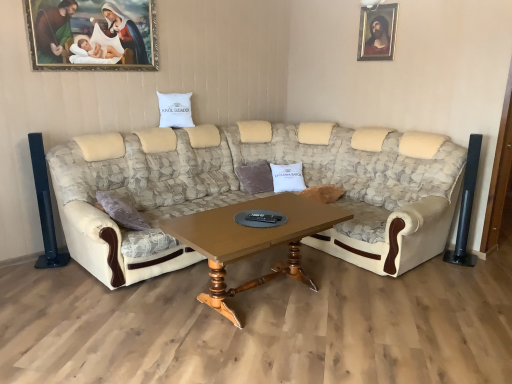
The image size is (512, 384). Find the location of `free location to the right of wooden polished table at center`. free location to the right of wooden polished table at center is located at coordinates (376, 316).